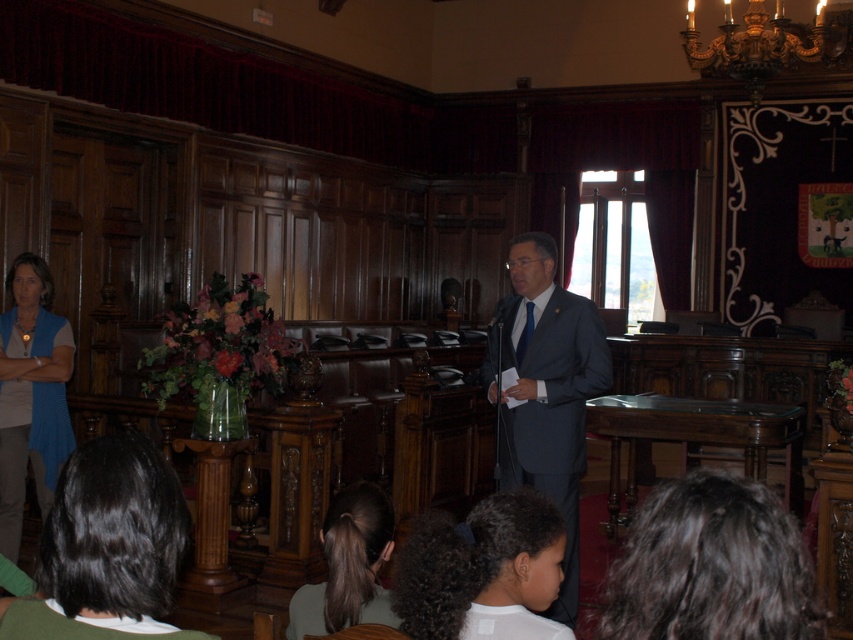
Looking at this image, you are a photographer standing in the room. You want to take a photo of both the dark brown hair at lower right and the dark brown hair at lower center so that both are clearly visible in the frame. Given that your camera has a maximum focus range of 30 inches, will you be able to capture both subjects within the same focused shot?

The dark brown hair at lower right and dark brown hair at lower center are 29.93 inches apart from each other, which is within the camera maximum focus range of 30 inches. Therefore, you can capture both subjects in the same focused shot.

You are an architect designing a new courtroom and want to ensure the speaker can be seen clearly by all seated participants. Given the dark blue suit at center and the dark curly hair at lower center, which object is taller and would block the view if placed in front?

The dark blue suit at center is taller than the dark curly hair at lower center, so placing the dark blue suit at center in front would block the view more than the dark curly hair at lower center.